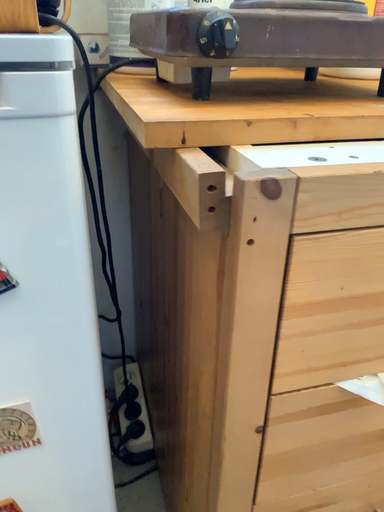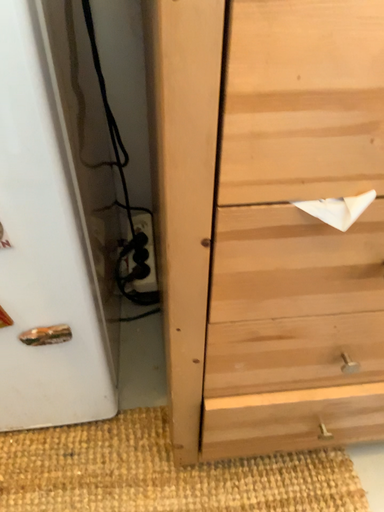
Question: Which way did the camera rotate in the video?

Choices:
 (A) rotated upward
 (B) rotated downward

Answer: (B)